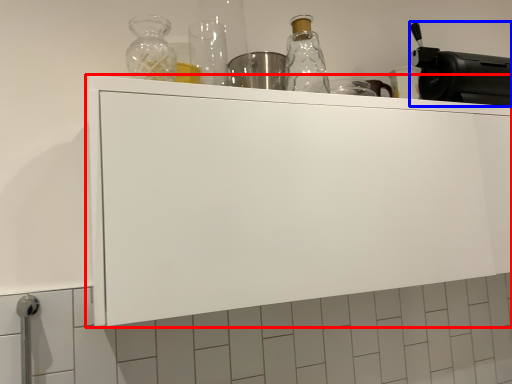
Question: Which object is closer to the camera taking this photo, cabinetry (highlighted by a red box) or appliance (highlighted by a blue box)?

Choices:
 (A) cabinetry
 (B) appliance

Answer: (A)